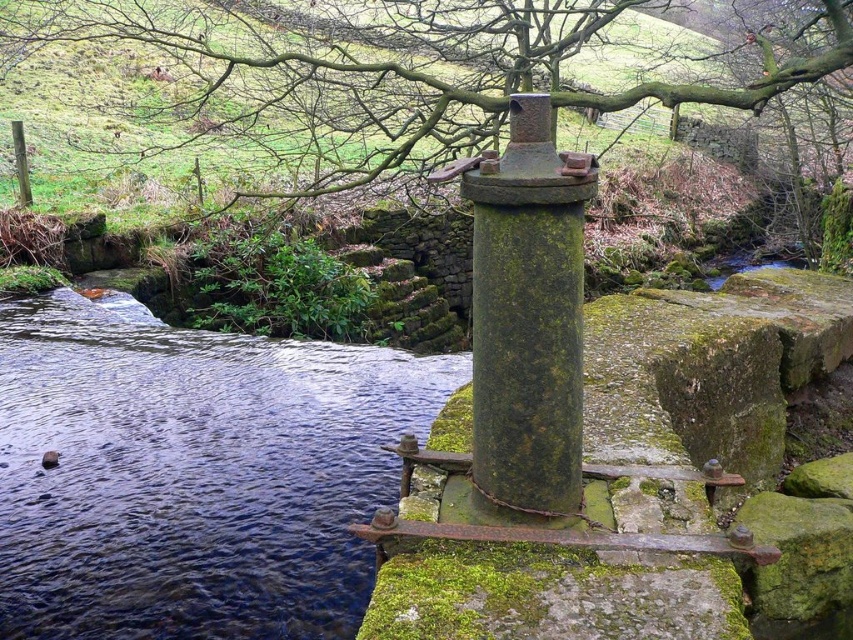
Is green mossy tree at center positioned before green mossy stone at center?

No.

The width and height of the screenshot is (853, 640). I want to click on green mossy tree at center, so tap(393, 68).

Between green mossy stone at lower left and green mossy tree at center, which one has less height?

With less height is green mossy stone at lower left.

Is green mossy stone at lower left wider than green mossy tree at center?

Incorrect, green mossy stone at lower left's width does not surpass green mossy tree at center's.

Image resolution: width=853 pixels, height=640 pixels. In order to click on green mossy stone at lower left in this screenshot , I will do `click(192, 474)`.

Can you confirm if green mossy stone at lower left is smaller than green mossy stone at center?

Actually, green mossy stone at lower left might be larger than green mossy stone at center.

Between green mossy stone at lower left and green mossy stone at center, which one is positioned lower?

green mossy stone at lower left

In the scene shown: Measure the distance between green mossy stone at lower left and camera.

green mossy stone at lower left and camera are 3.09 meters apart from each other.

Find the location of a particular element. The width and height of the screenshot is (853, 640). green mossy stone at lower left is located at coordinates (192, 474).